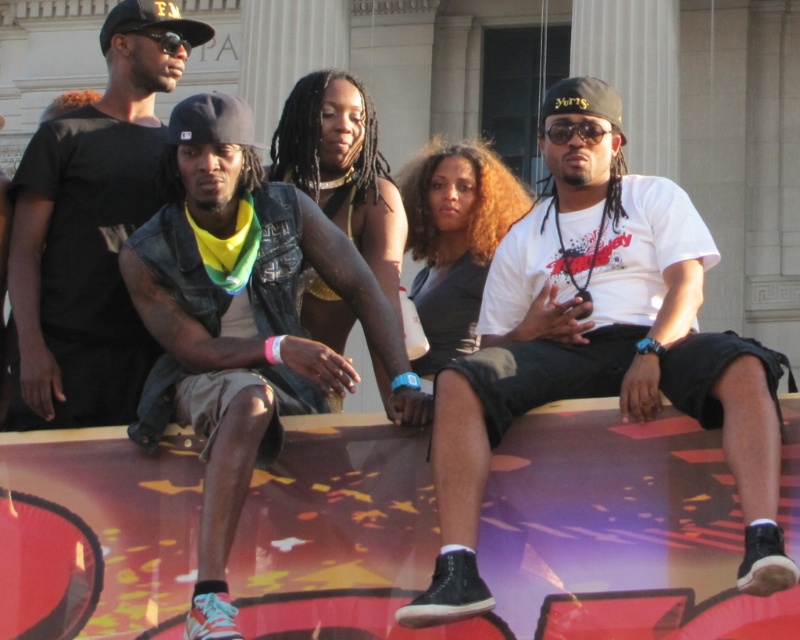
Is point (758, 348) farther from viewer compared to point (409, 371)?

No.

Can you confirm if white matte t-shirt at center is positioned above denim vest at center?

Yes.

Find the location of `white matte t-shirt at center`. white matte t-shirt at center is located at coordinates (600, 342).

Based on the photo, does denim vest at center appear on the left side of black matte t-shirt at upper left?

Incorrect, denim vest at center is not on the left side of black matte t-shirt at upper left.

Is point (154, 243) closer to viewer compared to point (28, 168)?

Yes, it is in front of point (28, 168).

You are a GUI agent. You are given a task and a screenshot of the screen. Output one action in this format:
    pyautogui.click(x=<x>, y=<y>)
    Task: Click on the denim vest at center
    The width and height of the screenshot is (800, 640).
    Given the screenshot: What is the action you would take?
    pyautogui.click(x=242, y=321)

This screenshot has height=640, width=800. What are the coordinates of `denim vest at center` in the screenshot? It's located at (242, 321).

Is the position of white matte t-shirt at center more distant than that of black matte t-shirt at upper left?

No, it is in front of black matte t-shirt at upper left.

Which is in front, point (690, 330) or point (110, 410)?

Point (690, 330) is more forward.

Image resolution: width=800 pixels, height=640 pixels. What do you see at coordinates (600, 342) in the screenshot? I see `white matte t-shirt at center` at bounding box center [600, 342].

Where is `white matte t-shirt at center`? white matte t-shirt at center is located at coordinates (600, 342).